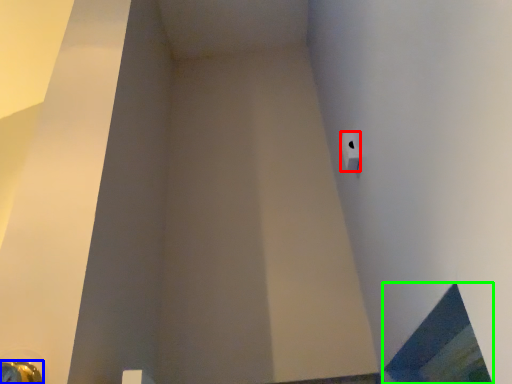
Question: Based on their relative distances, which object is farther from toilet paper (highlighted by a red box)? Choose from door handle (highlighted by a blue box) and window (highlighted by a green box).

Choices:
 (A) door handle
 (B) window

Answer: (A)